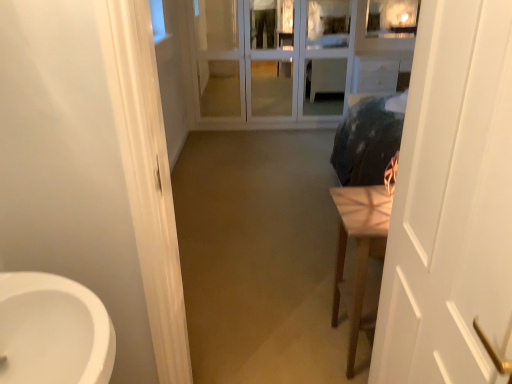
Question: Are white matte door at right and light brown wooden table at right located far from each other?

Choices:
 (A) yes
 (B) no

Answer: (B)

Question: Is white matte door at right wider than light brown wooden table at right?

Choices:
 (A) yes
 (B) no

Answer: (B)

Question: Does white matte door at right have a greater height compared to light brown wooden table at right?

Choices:
 (A) yes
 (B) no

Answer: (A)

Question: From the image's perspective, is white matte door at right located beneath light brown wooden table at right?

Choices:
 (A) yes
 (B) no

Answer: (B)

Question: From the image's perspective, is white matte door at right located above light brown wooden table at right?

Choices:
 (A) yes
 (B) no

Answer: (A)

Question: Is light brown wooden table at right surrounded by white matte door at right?

Choices:
 (A) yes
 (B) no

Answer: (B)

Question: Is white glass screen door at center surrounded by light brown wooden table at right?

Choices:
 (A) no
 (B) yes

Answer: (A)

Question: Is light brown wooden table at right taller than white glass screen door at center?

Choices:
 (A) yes
 (B) no

Answer: (B)

Question: From the image's perspective, is light brown wooden table at right located above white glass screen door at center?

Choices:
 (A) no
 (B) yes

Answer: (A)

Question: Is light brown wooden table at right shorter than white glass screen door at center?

Choices:
 (A) no
 (B) yes

Answer: (B)

Question: Is light brown wooden table at right beside white glass screen door at center?

Choices:
 (A) no
 (B) yes

Answer: (A)

Question: Is light brown wooden table at right at the left side of white glass screen door at center?

Choices:
 (A) yes
 (B) no

Answer: (B)

Question: From a real-world perspective, is white glass screen door at center located higher than light brown wooden table at right?

Choices:
 (A) no
 (B) yes

Answer: (B)